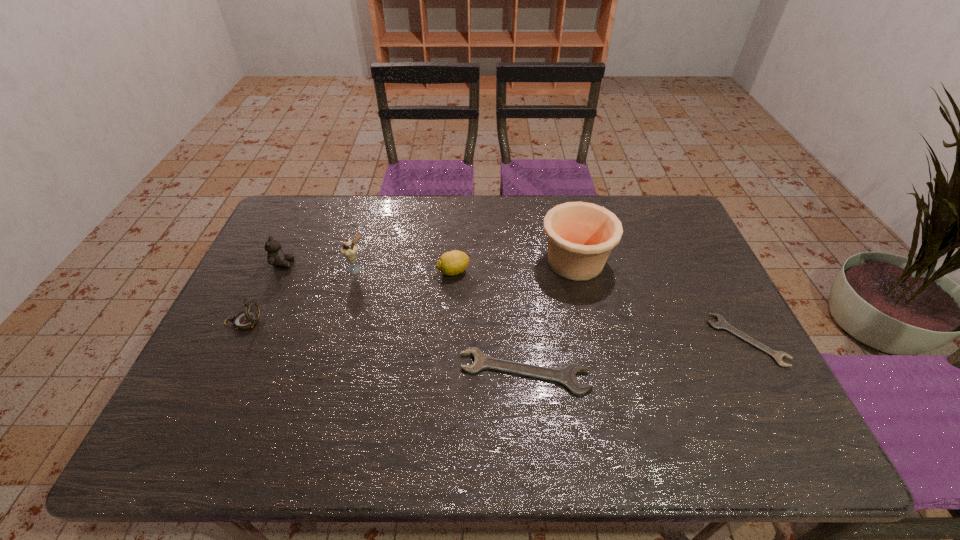
Where is `the sixth tallest object`? the sixth tallest object is located at coordinates (566, 376).

You are a GUI agent. You are given a task and a screenshot of the screen. Output one action in this format:
    pyautogui.click(x=<x>, y=<y>)
    Task: Click on the left wrench
    The height and width of the screenshot is (540, 960).
    Given the screenshot: What is the action you would take?
    pyautogui.click(x=566, y=376)

Where is `the right wrench`? This screenshot has height=540, width=960. the right wrench is located at coordinates (721, 323).

The width and height of the screenshot is (960, 540). I want to click on the shortest object, so click(x=721, y=323).

This screenshot has width=960, height=540. Find the location of `teddy bear`. teddy bear is located at coordinates (276, 257).

I want to click on the fifth object from right to left, so click(x=349, y=249).

Image resolution: width=960 pixels, height=540 pixels. I want to click on lemon, so click(x=454, y=262).

At what (x,y) coordinates should I click in order to perform the action: click on pottery. Please return your answer as a coordinate pair (x, y). Looking at the image, I should click on (580, 236).

Locate an element on the screen. This screenshot has width=960, height=540. compass is located at coordinates (246, 319).

This screenshot has height=540, width=960. I want to click on vacant region located 0.180m on the left of the left wrench, so click(x=387, y=372).